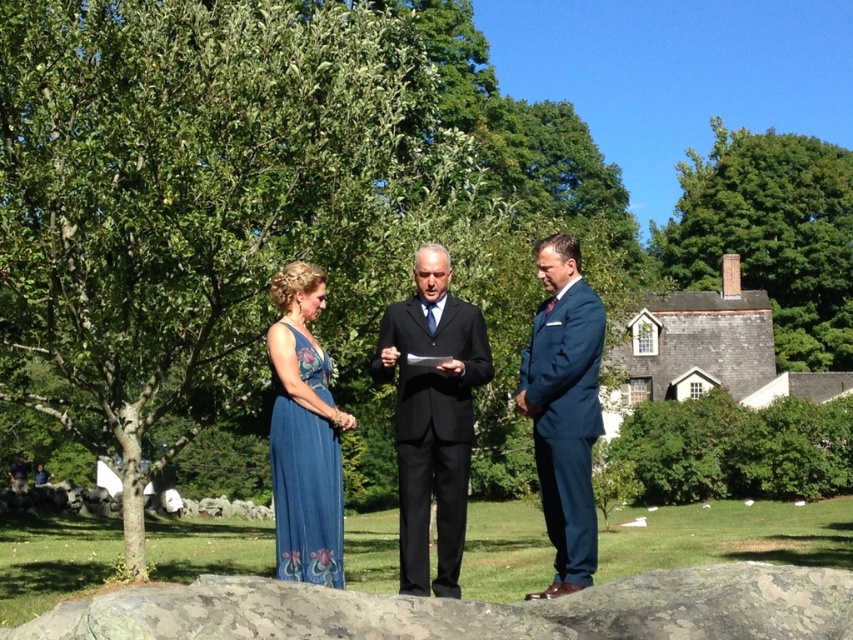
Question: Which of the following is the farthest from the observer?

Choices:
 (A) (422, 401)
 (B) (415, 387)

Answer: (B)

Question: Estimate the real-world distances between objects in this image. Which object is closer to the green leafy tree at center?

Choices:
 (A) black suit at center
 (B) blue satin dress at center
 (C) navy blue suit at center

Answer: (A)

Question: Which of the following is the closest to the observer?

Choices:
 (A) green leafy tree at upper right
 (B) navy blue suit at center
 (C) green leafy tree at center
 (D) blue satin dress at center

Answer: (B)

Question: Where is green leafy tree at center located in relation to matte blue dress at center in the image?

Choices:
 (A) below
 (B) above

Answer: (B)

Question: Observing the image, what is the correct spatial positioning of green leafy tree at center in reference to navy blue suit at center?

Choices:
 (A) below
 (B) above

Answer: (B)

Question: Observing the image, what is the correct spatial positioning of matte blue dress at center in reference to navy blue suit at center?

Choices:
 (A) above
 (B) below

Answer: (B)